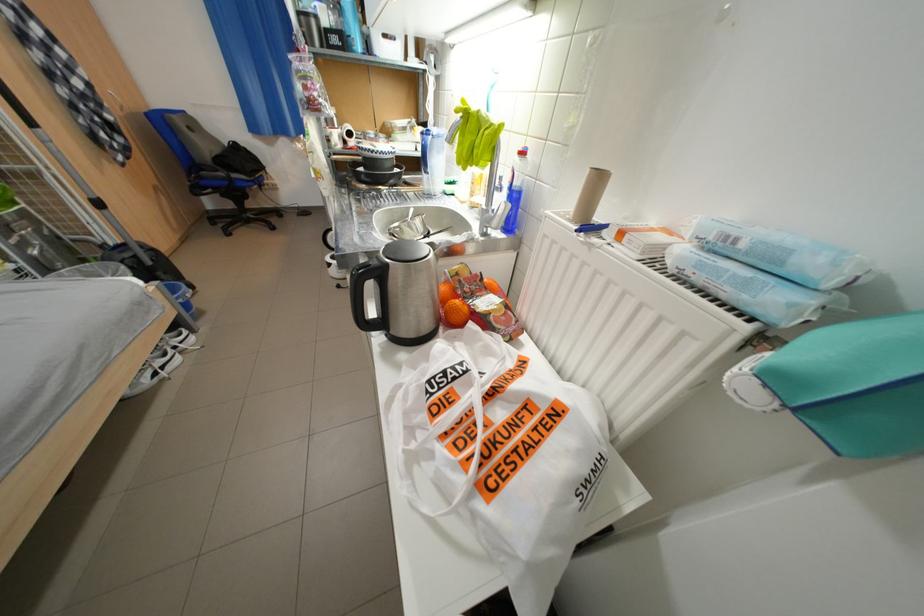
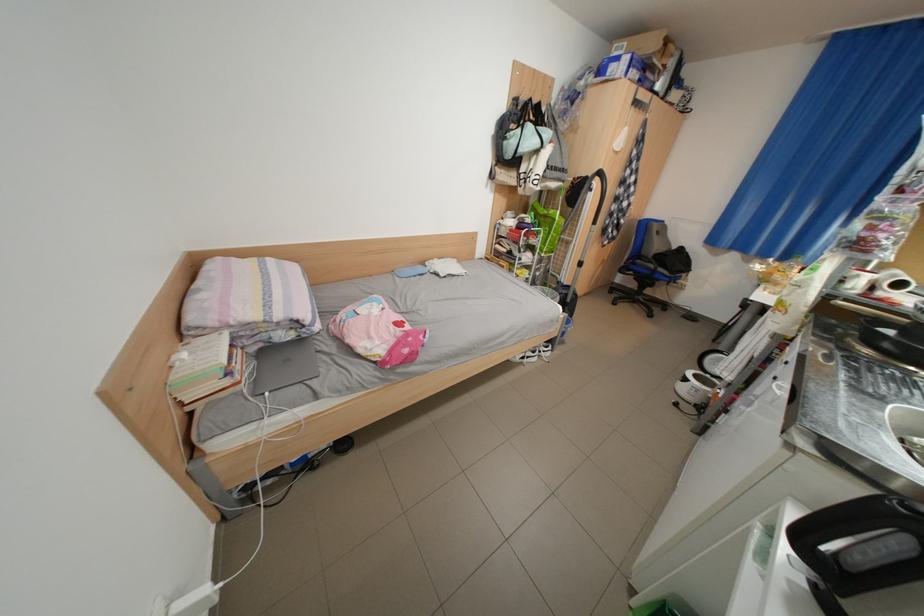
The point at (345, 257) is marked in the first image. Where is the corresponding point in the second image?

(708, 377)